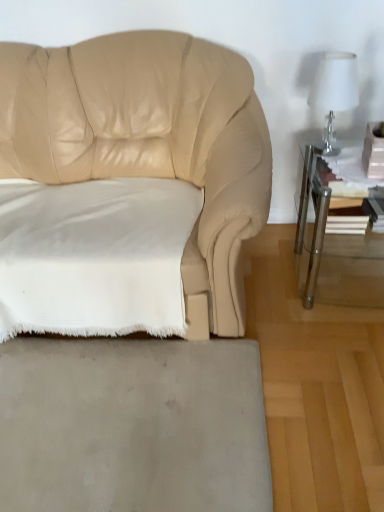
Locate an element on the screen. The image size is (384, 512). free location in front of clear glass table at right is located at coordinates (335, 349).